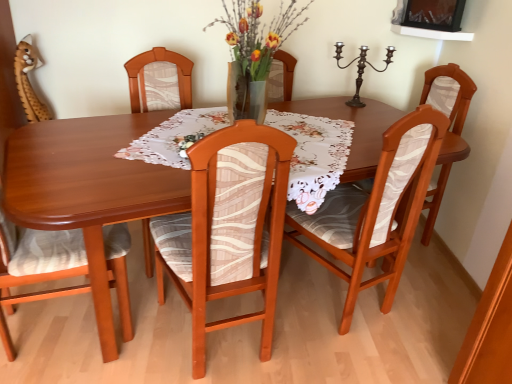
Question: From a real-world perspective, is wooden table at center physically below wooden chair with patterned fabric at center, placed as the third chair when sorted from left to right?

Choices:
 (A) no
 (B) yes

Answer: (B)

Question: Is wooden table at center bigger than wooden chair with patterned fabric at center, placed as the third chair when sorted from left to right?

Choices:
 (A) no
 (B) yes

Answer: (B)

Question: From a real-world perspective, is wooden table at center on wooden chair with patterned fabric at center, placed as the third chair when sorted from left to right?

Choices:
 (A) no
 (B) yes

Answer: (A)

Question: Does wooden table at center lie behind wooden chair with patterned fabric at center, placed as the third chair when sorted from left to right?

Choices:
 (A) yes
 (B) no

Answer: (A)

Question: Can you confirm if wooden table at center is positioned to the right of wooden chair with patterned fabric at center, which ranks as the 3th chair in right-to-left order?

Choices:
 (A) no
 (B) yes

Answer: (B)

Question: Is point (203, 274) positioned closer to the camera than point (29, 97)?

Choices:
 (A) closer
 (B) farther

Answer: (A)

Question: From the image's perspective, is wooden chair with patterned fabric at center, which ranks as the 3th chair in right-to-left order, above or below brown plush toy at upper left?

Choices:
 (A) above
 (B) below

Answer: (B)

Question: In terms of size, does wooden chair with patterned fabric at center, which ranks as the 3th chair in right-to-left order, appear bigger or smaller than brown plush toy at upper left?

Choices:
 (A) big
 (B) small

Answer: (A)

Question: Considering the positions of wooden chair with patterned fabric at center, which ranks as the 3th chair in right-to-left order, and brown plush toy at upper left in the image, is wooden chair with patterned fabric at center, which ranks as the 3th chair in right-to-left order, wider or thinner than brown plush toy at upper left?

Choices:
 (A) thin
 (B) wide

Answer: (B)

Question: Relative to bronze metallic candle holder at upper right, is wooden chair at right, which is counted as the 5th chair, starting from the left, in front or behind?

Choices:
 (A) behind
 (B) front

Answer: (B)

Question: Choose the correct answer: Is wooden chair at right, which is counted as the 5th chair, starting from the left, inside bronze metallic candle holder at upper right or outside it?

Choices:
 (A) inside
 (B) outside

Answer: (B)

Question: Considering the positions of wooden chair at right, which is counted as the 5th chair, starting from the left, and bronze metallic candle holder at upper right in the image, is wooden chair at right, which is counted as the 5th chair, starting from the left, taller or shorter than bronze metallic candle holder at upper right?

Choices:
 (A) short
 (B) tall

Answer: (B)

Question: Is wooden chair at right, which is the 1th chair from right to left, to the left or to the right of bronze metallic candle holder at upper right in the image?

Choices:
 (A) right
 (B) left

Answer: (A)

Question: Is wooden table at center wider or thinner than wooden chair at right, which is counted as the 5th chair, starting from the left?

Choices:
 (A) thin
 (B) wide

Answer: (B)

Question: From the image's perspective, is wooden table at center above or below wooden chair at right, which is the 1th chair from right to left?

Choices:
 (A) below
 (B) above

Answer: (A)